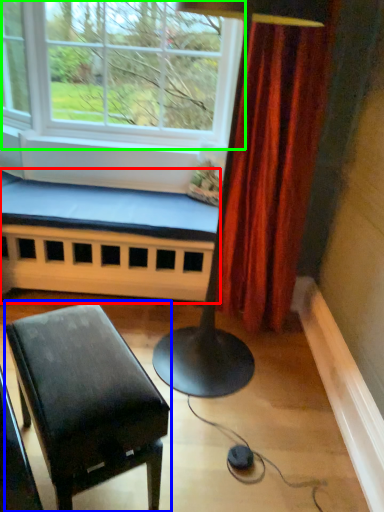
Question: Estimate the real-world distances between objects in this image. Which object is closer to church bench (highlighted by a red box), table (highlighted by a blue box) or window (highlighted by a green box)?

Choices:
 (A) table
 (B) window

Answer: (B)